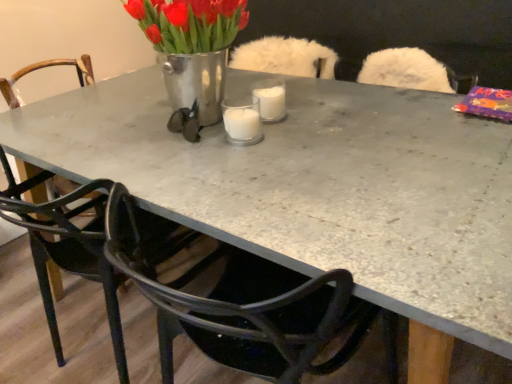
Question: Is metallic vase at center shorter than black plastic chair at lower left, which is the first chair from right to left?

Choices:
 (A) no
 (B) yes

Answer: (B)

Question: Can you confirm if metallic vase at center is positioned to the left of black plastic chair at lower left, positioned as the second chair in left-to-right order?

Choices:
 (A) yes
 (B) no

Answer: (A)

Question: Is metallic vase at center wider than black plastic chair at lower left, positioned as the second chair in left-to-right order?

Choices:
 (A) yes
 (B) no

Answer: (B)

Question: Can you confirm if metallic vase at center is thinner than black plastic chair at lower left, which is the first chair from right to left?

Choices:
 (A) yes
 (B) no

Answer: (A)

Question: Is metallic vase at center positioned behind black plastic chair at lower left, which is the first chair from right to left?

Choices:
 (A) no
 (B) yes

Answer: (B)

Question: In terms of height, does black metal chair at center, acting as the second chair starting from the right, look taller or shorter compared to metallic vase at center?

Choices:
 (A) tall
 (B) short

Answer: (A)

Question: In the image, is black metal chair at center, arranged as the first chair when viewed from the left, positioned in front of or behind metallic vase at center?

Choices:
 (A) behind
 (B) front

Answer: (B)

Question: Considering the positions of black metal chair at center, arranged as the first chair when viewed from the left, and metallic vase at center in the image, is black metal chair at center, arranged as the first chair when viewed from the left, bigger or smaller than metallic vase at center?

Choices:
 (A) big
 (B) small

Answer: (A)

Question: Is black metal chair at center, acting as the second chair starting from the right, spatially inside metallic vase at center, or outside of it?

Choices:
 (A) inside
 (B) outside

Answer: (B)

Question: Is clear glass candle at center to the left or to the right of black metal chair at center, arranged as the first chair when viewed from the left, in the image?

Choices:
 (A) left
 (B) right

Answer: (B)

Question: From the image's perspective, is clear glass candle at center positioned above or below black metal chair at center, acting as the second chair starting from the right?

Choices:
 (A) above
 (B) below

Answer: (A)

Question: Is clear glass candle at center taller or shorter than black metal chair at center, arranged as the first chair when viewed from the left?

Choices:
 (A) tall
 (B) short

Answer: (B)

Question: Looking at the image, does clear glass candle at center seem bigger or smaller compared to black metal chair at center, acting as the second chair starting from the right?

Choices:
 (A) big
 (B) small

Answer: (B)

Question: From a real-world perspective, relative to black plastic chair at lower left, positioned as the second chair in left-to-right order, is metallic vase at center vertically above or below?

Choices:
 (A) below
 (B) above

Answer: (B)

Question: Is metallic vase at center bigger or smaller than black plastic chair at lower left, positioned as the second chair in left-to-right order?

Choices:
 (A) big
 (B) small

Answer: (B)